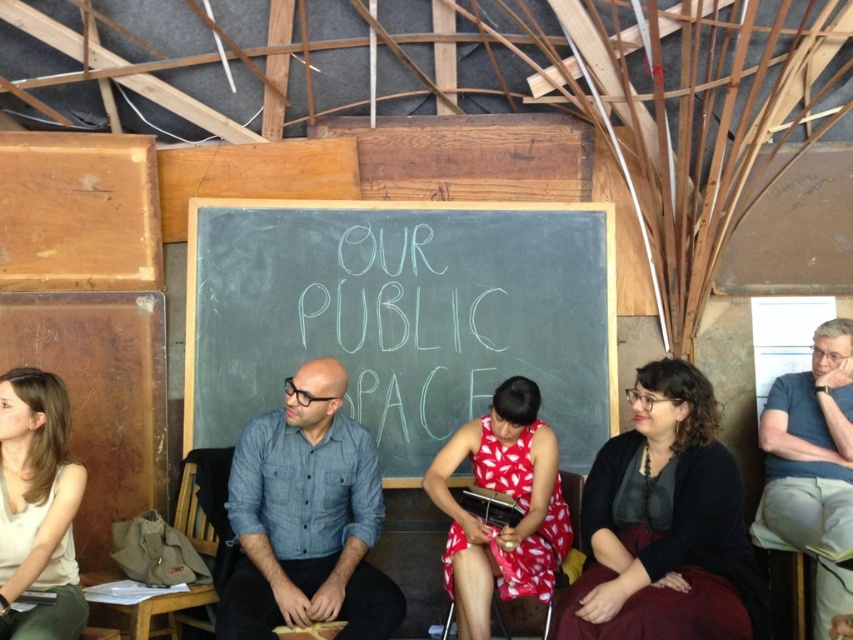
Question: Is dark gray sweater at center in front of denim shirt at center?

Choices:
 (A) no
 (B) yes

Answer: (B)

Question: Can you confirm if red printed dress at center is thinner than blue shirt at right?

Choices:
 (A) no
 (B) yes

Answer: (A)

Question: Is denim shirt at center smaller than light beige fabric shirt at lower left?

Choices:
 (A) yes
 (B) no

Answer: (B)

Question: Which point is farther from the camera taking this photo?

Choices:
 (A) (303, 337)
 (B) (646, 621)
 (C) (846, 609)

Answer: (A)

Question: Among these points, which one is farthest from the camera?

Choices:
 (A) (782, 493)
 (B) (724, 497)
 (C) (471, 433)
 (D) (78, 490)

Answer: (A)

Question: Which point appears closest to the camera in this image?

Choices:
 (A) (315, 324)
 (B) (321, 540)
 (C) (15, 474)

Answer: (C)